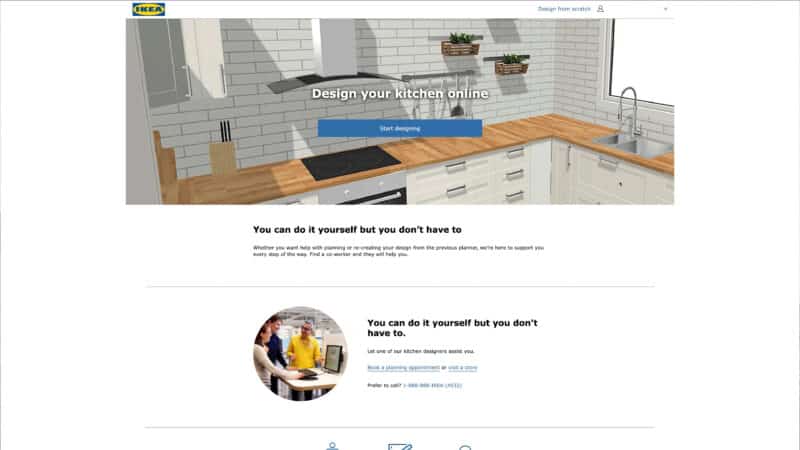
Locate an element on the screen. The width and height of the screenshot is (800, 450). wooden countertop is located at coordinates (582, 126), (542, 121), (502, 137), (289, 172), (233, 181), (666, 162).